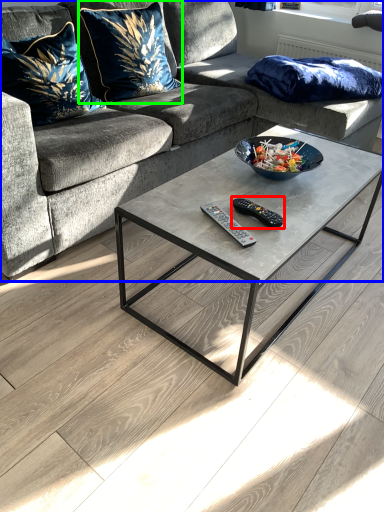
Question: Considering the real-world distances, which object is farthest from remote (highlighted by a red box)? studio couch (highlighted by a blue box) or pillow (highlighted by a green box)?

Choices:
 (A) studio couch
 (B) pillow

Answer: (B)